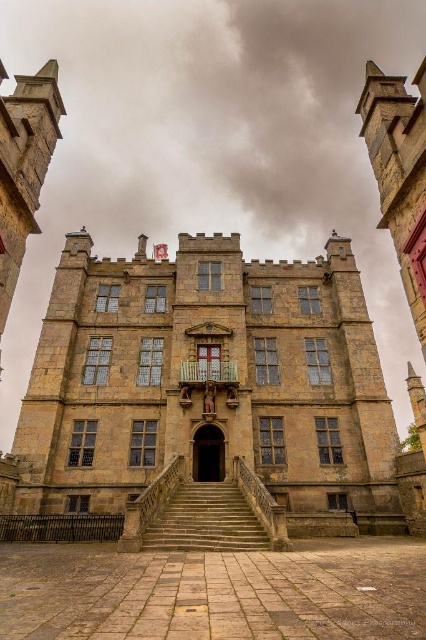
You are an architect planning to install a new decorative element on the stone castle at center and the brown stone archway at center. Based on their widths, which structure would require a larger decorative element to maintain proportion?

The stone castle at center might be wider than brown stone archway at center, so the decorative element for the stone castle at center should be larger to maintain proportion.

You are a tour guide leading a group to the stone castle at center. You notice the stone textured stairs at center leading towards the castle. Can you tell the group whether the castle is wider than the stairs?

The stone castle at center is wider than the stone textured stairs at center, so yes, the castle is wider than the stairs.

You are an architect assessing the stone castle at center and the stone textured stairs at center in the image. Which structure is taller?

The stone castle at center is taller than the stone textured stairs at center.